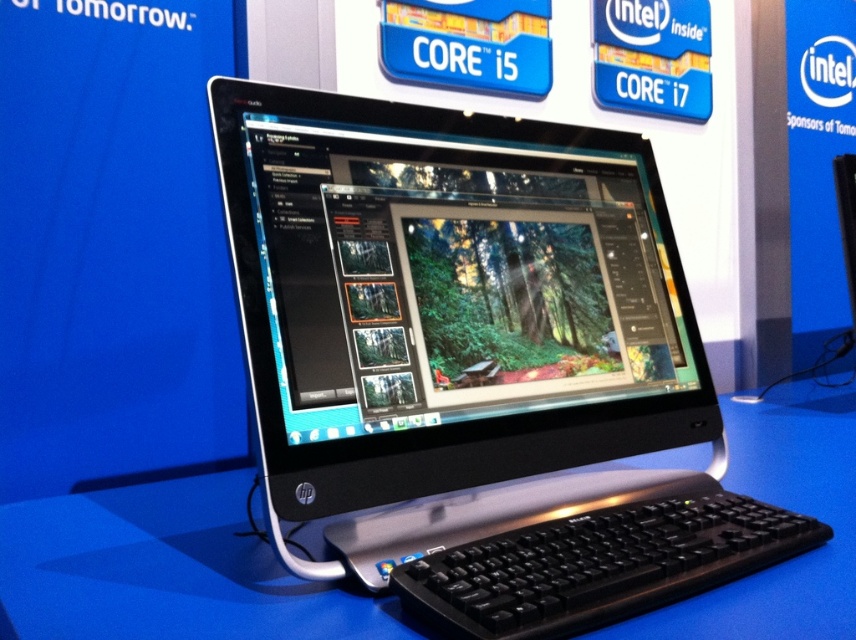
You are at a tech exhibition and see a modern HP All in One desktop computer setup on a blue surface. The setup includes a monitor with a photo editing software interface showing a forest scene. There is a point marked at coordinates (476, 362). What object is located at this point?

The point at coordinates (476, 362) marks the black plastic monitor at center.

You are a tech reviewer examining the HP All in One setup. You need to describe the spatial arrangement between the black plastic monitor at center and the black plastic keyboard at lower center. Which object is positioned to the left?

The black plastic monitor at center is positioned to the left of the black plastic keyboard at lower center.

You are a tech reviewer examining the HP All in One desktop setup. You notice a specific point on the image at coordinates point (x=165, y=570). Based on the scene description, what object is located at that point?

The point (x=165, y=570) corresponds to the black plastic desktop at center.